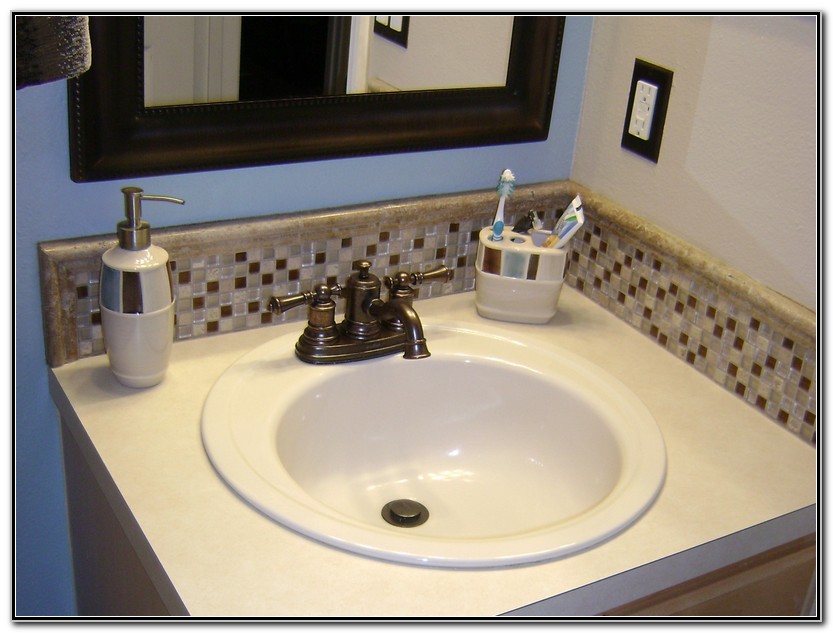
Where is `copper sink stopper`? This screenshot has width=833, height=633. copper sink stopper is located at coordinates (419, 506).